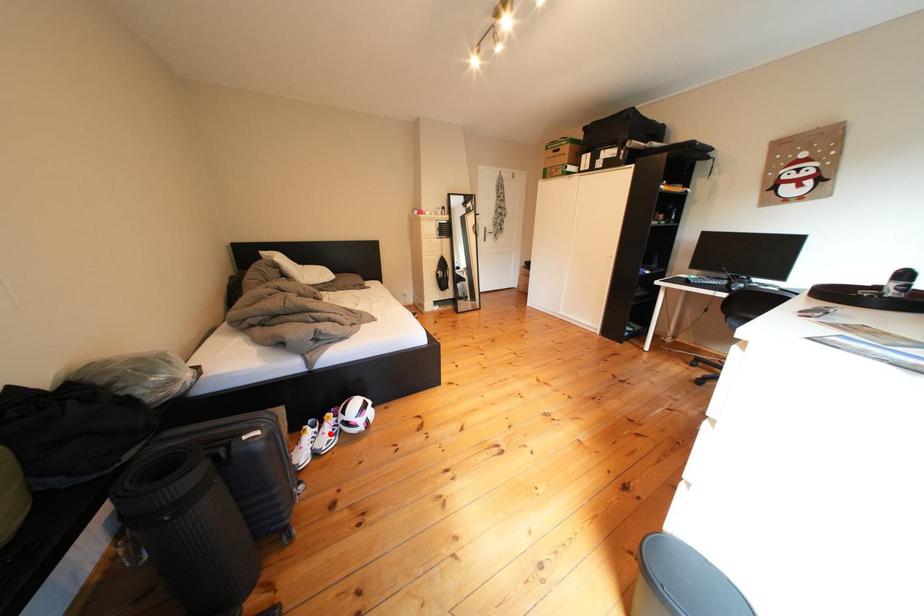
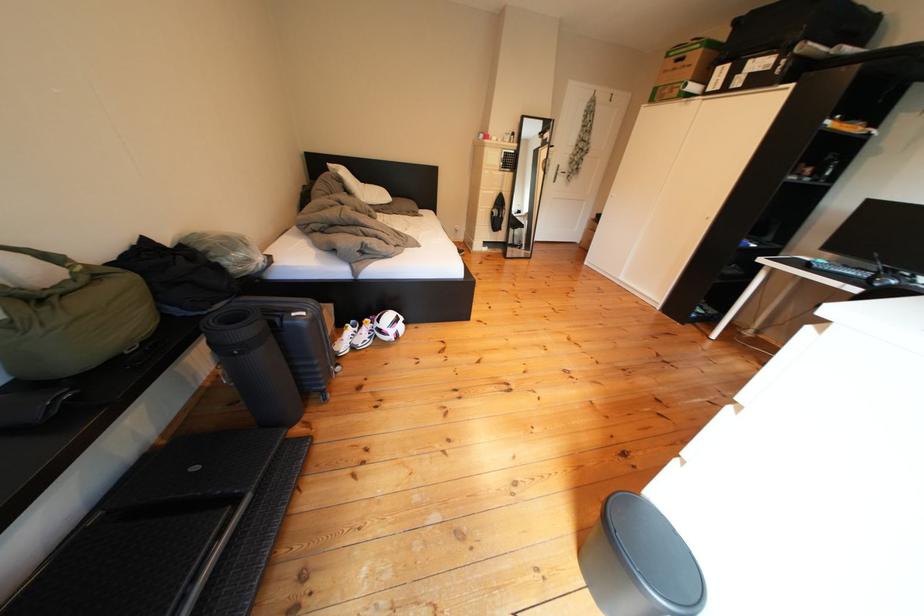
Where in the second image is the point corresponding to the highlighted location from the first image?

(370, 334)